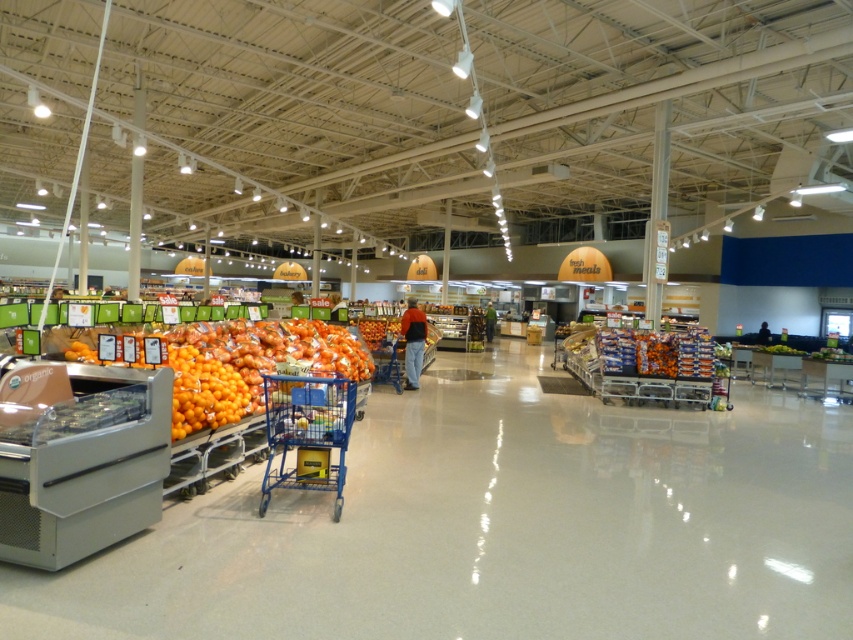
You are standing in the supermarket and want to move from the blue shopping cart near the produce section to the point marked as point [317,477]. However, there is an obstacle at point [224,356]. Will you be able to walk around the obstacle to reach your destination?

Point [224,356] is further to the viewer than point [317,477]. This means the obstacle is closer to you, so you can walk around it to reach the destination point [317,477].

You are a customer in the supermarket and want to grab an orange from the orange matte produce at left before proceeding to the checkout counter located near the blue plastic shopping cart at center. Which object will you encounter first as you move towards the checkout counter?

The orange matte produce at left is closer to the viewer than the blue plastic shopping cart at center, so you will encounter the orange matte produce at left first before reaching the checkout counter.